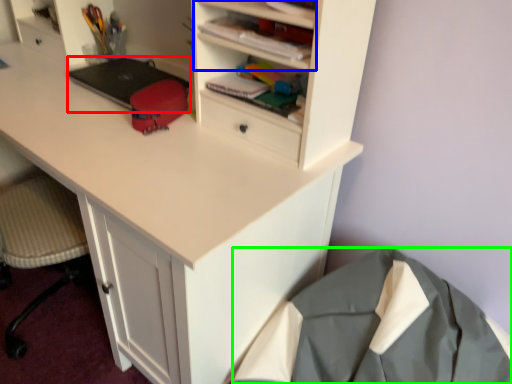
Question: Which is farther away from laptop (highlighted by a red box)? cabinet (highlighted by a blue box) or clothing (highlighted by a green box)?

Choices:
 (A) cabinet
 (B) clothing

Answer: (B)